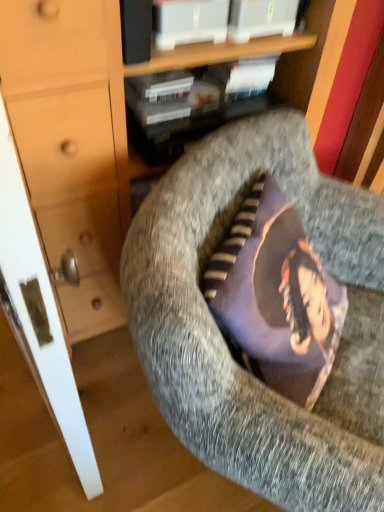
Question: Is textured gray cushion at center wider or thinner than matte wood dresser at center?

Choices:
 (A) wide
 (B) thin

Answer: (A)

Question: Based on their sizes in the image, would you say textured gray cushion at center is bigger or smaller than matte wood dresser at center?

Choices:
 (A) small
 (B) big

Answer: (B)

Question: Considering the real-world distances, which object is farthest from the matte wood dresser at center?

Choices:
 (A) matte black book at upper center
 (B) textured gray cushion at center

Answer: (B)

Question: Which of these objects is positioned closest to the matte wood dresser at center?

Choices:
 (A) matte black book at upper center
 (B) textured gray cushion at center

Answer: (A)